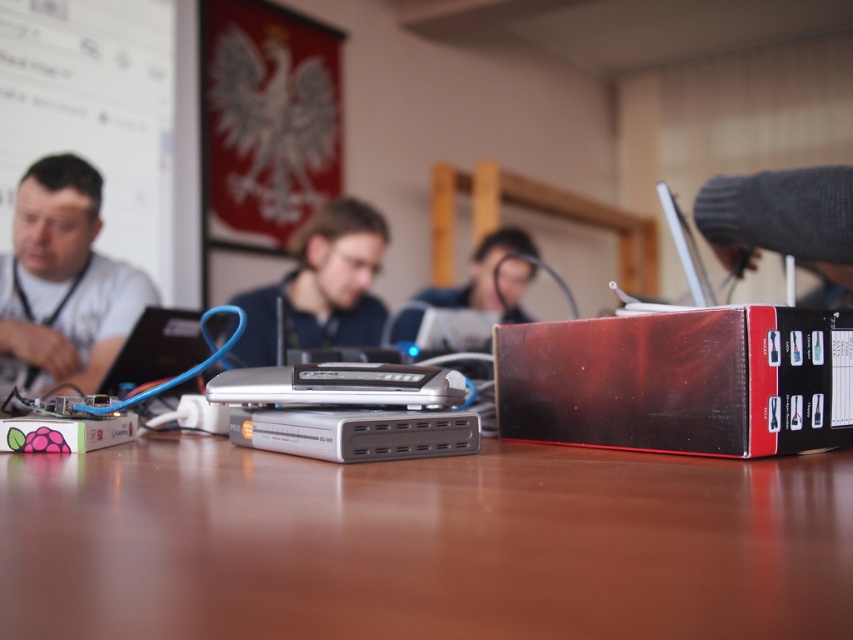
Who is taller, brown wooden table at center or matte black router at center?

With more height is matte black router at center.

Where is `brown wooden table at center`? The height and width of the screenshot is (640, 853). brown wooden table at center is located at coordinates (422, 544).

Measure the distance between brown wooden table at center and camera.

The distance of brown wooden table at center from camera is 21.88 centimeters.

Where is `brown wooden table at center`? brown wooden table at center is located at coordinates (422, 544).

Is point (634, 618) farther from camera compared to point (10, 330)?

No, (634, 618) is closer to viewer.

Does brown wooden table at center appear on the right side of white matte shirt at left?

Yes, brown wooden table at center is to the right of white matte shirt at left.

Is point (422, 577) positioned behind point (85, 337)?

No, it is not.

I want to click on brown wooden table at center, so click(422, 544).

Is white matte shirt at left bigger than smooth plastic face at center?

No.

Which is more to the left, white matte shirt at left or smooth plastic face at center?

white matte shirt at left

Is point (50, 177) less distant than point (483, 246)?

Yes, point (50, 177) is closer to viewer.

Identify the location of white matte shirt at left. Image resolution: width=853 pixels, height=640 pixels. (62, 282).